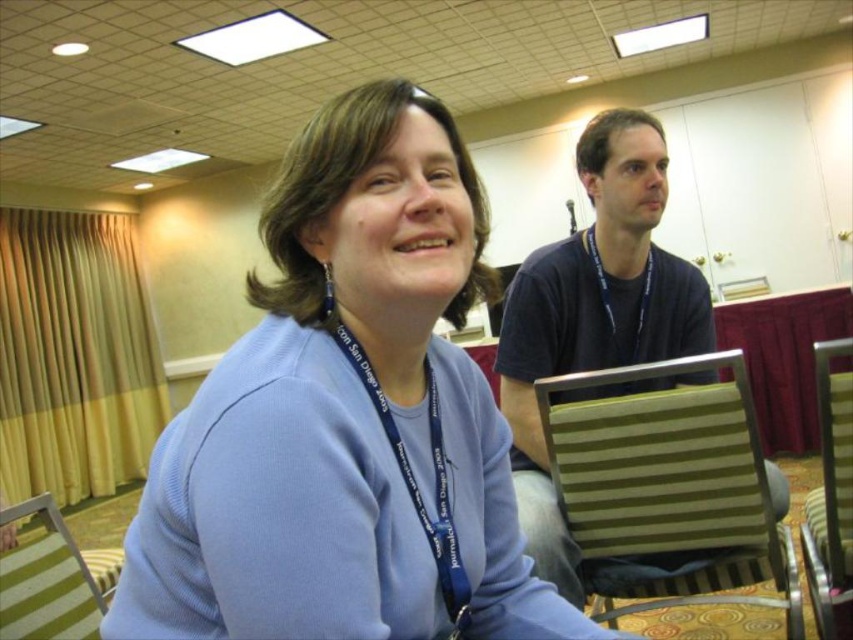
Can you confirm if green striped chair at right is shorter than blue fabric lanyard at upper center?

No, green striped chair at right is not shorter than blue fabric lanyard at upper center.

Is the position of green striped chair at right less distant than that of blue fabric lanyard at upper center?

Yes, it is in front of blue fabric lanyard at upper center.

What do you see at coordinates (671, 484) in the screenshot? I see `green striped chair at right` at bounding box center [671, 484].

Find the location of a particular element. green striped chair at right is located at coordinates (671, 484).

Does matte blue sweater at center appear on the right side of dark blue t-shirt at upper right?

In fact, matte blue sweater at center is to the left of dark blue t-shirt at upper right.

In the scene shown: Does matte blue sweater at center have a lesser height compared to dark blue t-shirt at upper right?

Yes, matte blue sweater at center is shorter than dark blue t-shirt at upper right.

Who is more forward, (297, 452) or (561, 355)?

Point (297, 452)

Find the location of `matte blue sweater at center`. matte blue sweater at center is located at coordinates (347, 419).

Which of these two, dark blue t-shirt at upper right or metallic striped chair at right, stands taller?

With more height is dark blue t-shirt at upper right.

Does dark blue t-shirt at upper right appear over metallic striped chair at right?

Yes.

You are a GUI agent. You are given a task and a screenshot of the screen. Output one action in this format:
    pyautogui.click(x=<x>, y=<y>)
    Task: Click on the dark blue t-shirt at upper right
    The image size is (853, 640).
    Given the screenshot: What is the action you would take?
    pyautogui.click(x=595, y=314)